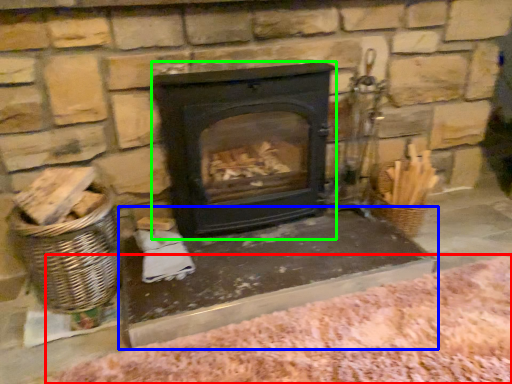
Question: Which is farther away from blanket (highlighted by a red box)? table (highlighted by a blue box) or wood burning stove (highlighted by a green box)?

Choices:
 (A) table
 (B) wood burning stove

Answer: (B)